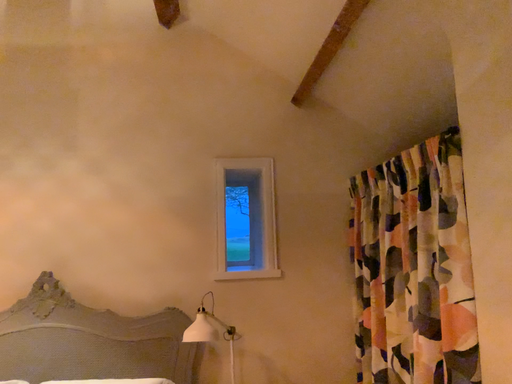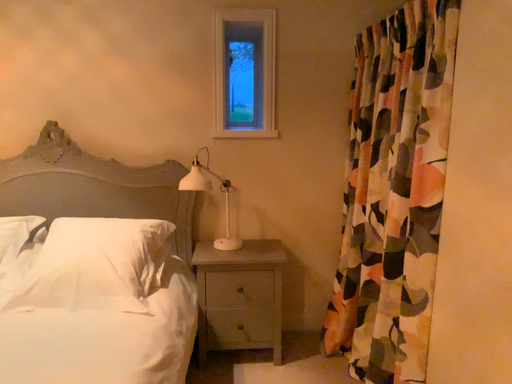
Question: How did the camera likely rotate when shooting the video?

Choices:
 (A) rotated upward
 (B) rotated downward

Answer: (B)